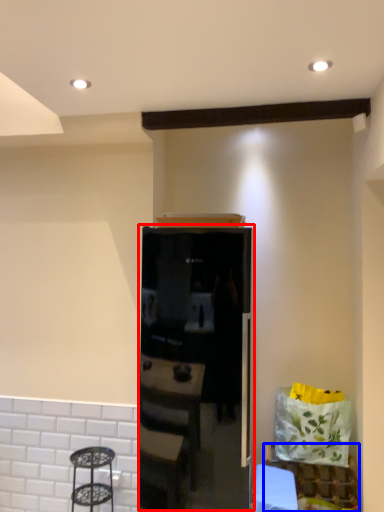
Question: Which object is closer to the camera taking this photo, appliance (highlighted by a red box) or furniture (highlighted by a blue box)?

Choices:
 (A) appliance
 (B) furniture

Answer: (A)